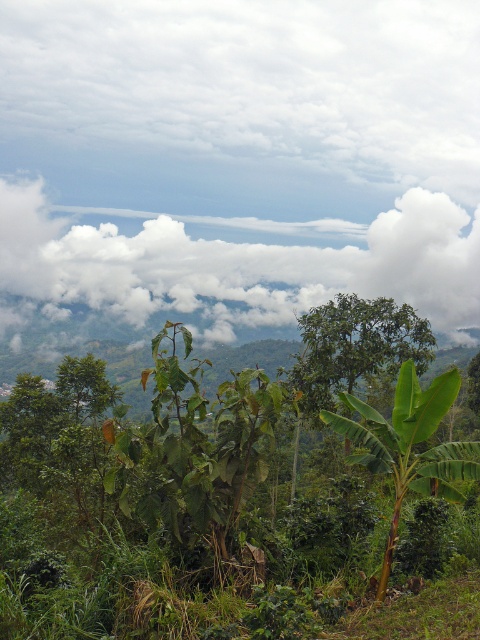
Does white fluffy cloud at upper center lie behind green leafy plant at center?

That is True.

Does white fluffy cloud at upper center appear on the left side of green leafy plant at center?

Yes, white fluffy cloud at upper center is to the left of green leafy plant at center.

This screenshot has height=640, width=480. I want to click on white fluffy cloud at upper center, so [x=229, y=266].

The image size is (480, 640). In order to click on white fluffy cloud at upper center in this screenshot , I will do `click(229, 266)`.